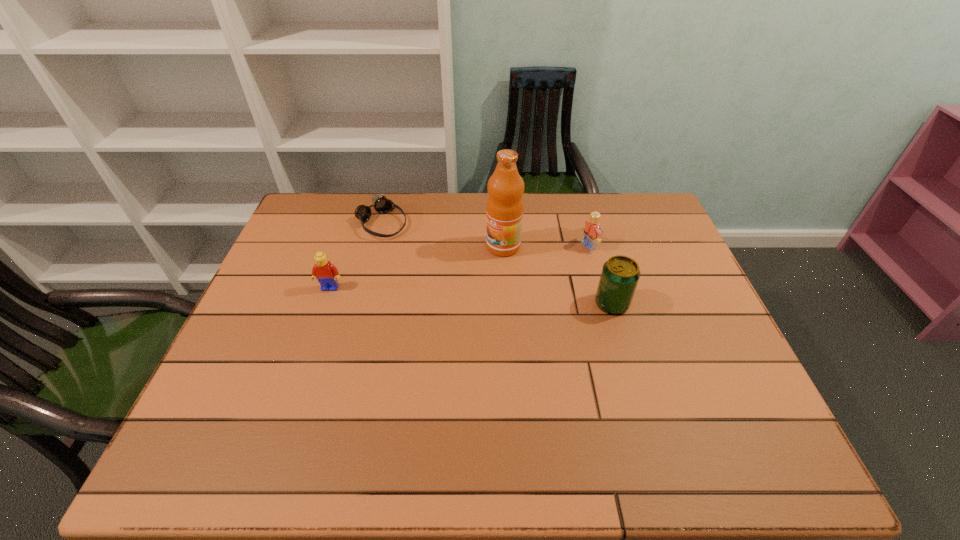
Find the location of `free region located on the front-facing side of the farther Lego`. free region located on the front-facing side of the farther Lego is located at coordinates (528, 271).

The image size is (960, 540). Identify the location of vacant region located 0.280m through the lenses of the goggles. (452, 281).

Find the location of `vacant region located through the lenses of the goggles`. vacant region located through the lenses of the goggles is located at coordinates (459, 287).

At what (x,y) coordinates should I click in order to perform the action: click on blank space located 0.350m through the lenses of the goggles. Please return your answer as a coordinate pair (x, y). The image size is (960, 540). Looking at the image, I should click on (468, 294).

You are a GUI agent. You are given a task and a screenshot of the screen. Output one action in this format:
    pyautogui.click(x=<x>, y=<y>)
    Task: Click on the vacant space located on the label side of the fruit juice
    
    Given the screenshot: What is the action you would take?
    pyautogui.click(x=444, y=285)

In order to click on blank space located on the label side of the fruit juice in this screenshot , I will do `click(430, 294)`.

Where is `vacant position located 0.090m on the label side of the fruit juice`? The height and width of the screenshot is (540, 960). vacant position located 0.090m on the label side of the fruit juice is located at coordinates (469, 268).

At what (x,y) coordinates should I click in order to perform the action: click on object that is at the far edge. Please return your answer as a coordinate pair (x, y). Looking at the image, I should click on (381, 204).

The width and height of the screenshot is (960, 540). I want to click on object positioned at the left edge, so click(x=326, y=273).

The image size is (960, 540). I want to click on vacant space at the far edge of the desktop, so click(x=444, y=223).